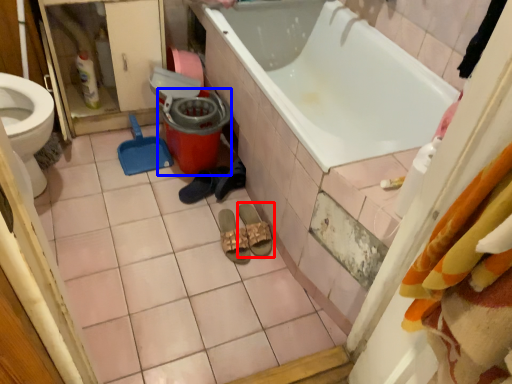
Question: Which object appears closest to the camera in this image, footwear (highlighted by a red box) or potty (highlighted by a blue box)?

Choices:
 (A) footwear
 (B) potty

Answer: (A)